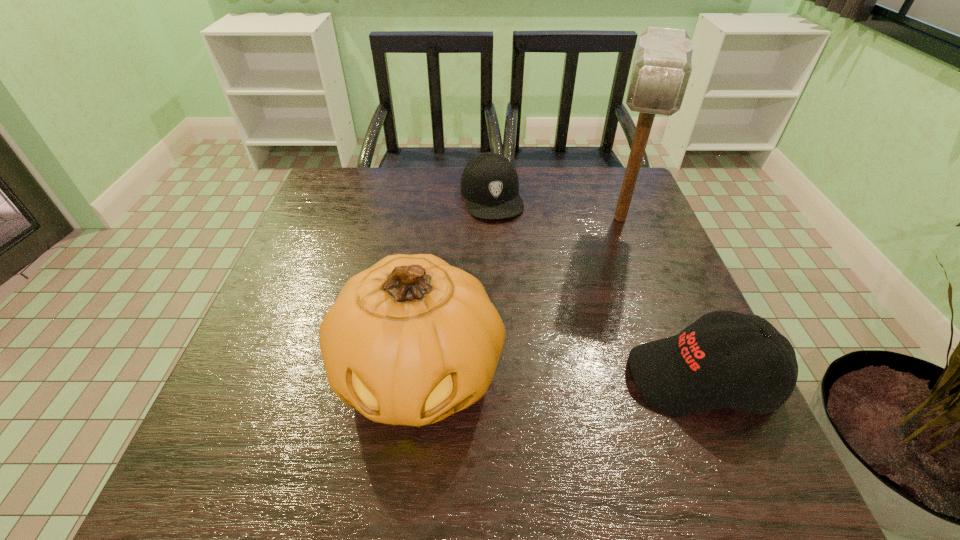
The height and width of the screenshot is (540, 960). What are the coordinates of `vacant area that lies between the tallest object and the baseball cap` in the screenshot? It's located at (660, 298).

You are a GUI agent. You are given a task and a screenshot of the screen. Output one action in this format:
    pyautogui.click(x=<x>, y=<y>)
    Task: Click on the vacant area between the third tallest object and the cap
    
    Given the screenshot: What is the action you would take?
    pyautogui.click(x=596, y=287)

This screenshot has width=960, height=540. Find the location of `free spot between the baseball cap and the tallest object`. free spot between the baseball cap and the tallest object is located at coordinates (660, 298).

Locate an element on the screen. The image size is (960, 540). vacant space that's between the baseball cap and the shortest object is located at coordinates (596, 287).

Identify the location of free space between the cap and the baseball cap. (596, 287).

The image size is (960, 540). In order to click on the closest object to the pumpkin in this screenshot , I will do `click(688, 373)`.

Identify which object is located as the nearest to the tallest object. Please provide its 2D coordinates. Your answer should be formatted as a tuple, i.e. [(x, y)], where the tuple contains the x and y coordinates of a point satisfying the conditions above.

[(489, 183)]

Image resolution: width=960 pixels, height=540 pixels. I want to click on vacant space that satisfies the following two spatial constraints: 1. on the front face of the third tallest object; 2. on the front-facing side of the pumpkin, so click(420, 378).

I want to click on free region that satisfies the following two spatial constraints: 1. on the front face of the baseball cap; 2. on the front-facing side of the pumpkin, so click(420, 378).

Locate an element on the screen. The image size is (960, 540). free region that satisfies the following two spatial constraints: 1. on the front face of the baseball cap; 2. on the front-facing side of the pumpkin is located at coordinates (420, 378).